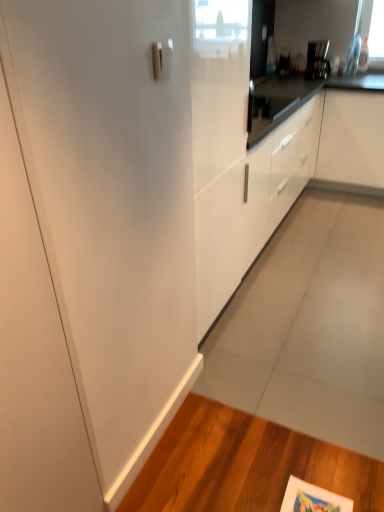
This screenshot has height=512, width=384. Identify the location of satin black coffee maker at upper right. (317, 60).

Based on the photo, is the surface of white glossy cabinet at center, acting as the second cabinetry starting from the right, in direct contact with white matte cabinet at center, placed as the 1th cabinetry when sorted from right to left?

No, white glossy cabinet at center, acting as the second cabinetry starting from the right, is not touching white matte cabinet at center, placed as the 1th cabinetry when sorted from right to left.

From a real-world perspective, between white glossy cabinet at center, acting as the second cabinetry starting from the right, and white matte cabinet at center, placed as the 1th cabinetry when sorted from right to left, who is vertically higher?

white glossy cabinet at center, acting as the second cabinetry starting from the right, from a real-world perspective.

In terms of width, does white glossy cabinet at center, which is the first cabinetry from left to right, look wider or thinner when compared to white matte cabinet at center, which is the second cabinetry in left-to-right order?

Clearly, white glossy cabinet at center, which is the first cabinetry from left to right, has more width compared to white matte cabinet at center, which is the second cabinetry in left-to-right order.

Considering the points (214, 217) and (340, 163), which point is in front, point (214, 217) or point (340, 163)?

Positioned in front is point (214, 217).

Which is more to the left, white glossy cabinet at center, acting as the second cabinetry starting from the right, or satin black coffee maker at upper right?

white glossy cabinet at center, acting as the second cabinetry starting from the right, is more to the left.

Relative to satin black coffee maker at upper right, is white glossy cabinet at center, which is the first cabinetry from left to right, in front or behind?

Clearly, white glossy cabinet at center, which is the first cabinetry from left to right, is in front of satin black coffee maker at upper right.

Can you see white glossy cabinet at center, which is the first cabinetry from left to right, touching satin black coffee maker at upper right?

No, white glossy cabinet at center, which is the first cabinetry from left to right, is not in contact with satin black coffee maker at upper right.

From the image's perspective, which one is positioned lower, white glossy cabinet at center, acting as the second cabinetry starting from the right, or satin black coffee maker at upper right?

From the image's view, white glossy cabinet at center, acting as the second cabinetry starting from the right, is below.

Can satin nickel door handle at upper center be found inside white matte cabinet at center, which is the second cabinetry in left-to-right order?

Definitely not — satin nickel door handle at upper center is not inside white matte cabinet at center, which is the second cabinetry in left-to-right order.

Which of these two, white matte cabinet at center, placed as the 1th cabinetry when sorted from right to left, or satin nickel door handle at upper center, stands taller?

Standing taller between the two is white matte cabinet at center, placed as the 1th cabinetry when sorted from right to left.

From a real-world perspective, is white matte cabinet at center, placed as the 1th cabinetry when sorted from right to left, physically located above or below satin nickel door handle at upper center?

Clearly, from a real-world perspective, white matte cabinet at center, placed as the 1th cabinetry when sorted from right to left, is below satin nickel door handle at upper center.

Can you see white matte cabinet at center, placed as the 1th cabinetry when sorted from right to left, touching satin nickel door handle at upper center?

No.

Does satin black coffee maker at upper right appear on the left side of satin nickel door handle at upper center?

No.

Where is `appliance behind the satin nickel door handle at upper center`? The height and width of the screenshot is (512, 384). appliance behind the satin nickel door handle at upper center is located at coordinates (317, 60).

Choose the correct answer: Is satin black coffee maker at upper right inside satin nickel door handle at upper center or outside it?

satin black coffee maker at upper right is not enclosed by satin nickel door handle at upper center.

From a real-world perspective, which object rests below the other?

satin black coffee maker at upper right is physically lower.

How much distance is there between satin nickel door handle at upper center and satin black coffee maker at upper right?

satin nickel door handle at upper center and satin black coffee maker at upper right are 3.02 meters apart from each other.

Is satin nickel door handle at upper center looking in the opposite direction of satin black coffee maker at upper right?

satin nickel door handle at upper center does not have its back to satin black coffee maker at upper right.

Can satin black coffee maker at upper right be found inside satin nickel door handle at upper center?

That's incorrect, satin black coffee maker at upper right is not inside satin nickel door handle at upper center.

Does satin nickel door handle at upper center have a lesser height compared to satin black coffee maker at upper right?

A: Yes, satin nickel door handle at upper center is shorter than satin black coffee maker at upper right.

From the image's perspective, relative to white glossy cabinet at center, which is the first cabinetry from left to right, is satin nickel door handle at upper center above or below?

satin nickel door handle at upper center is situated lower than white glossy cabinet at center, which is the first cabinetry from left to right, in the image.

Locate an element on the screen. The image size is (384, 512). door handle that is below the white glossy cabinet at center, which is the first cabinetry from left to right (from the image's perspective) is located at coordinates (162, 59).

Is satin nickel door handle at upper center not near white glossy cabinet at center, acting as the second cabinetry starting from the right?

Yes.

Would you say satin nickel door handle at upper center is outside white glossy cabinet at center, which is the first cabinetry from left to right?

That's correct, satin nickel door handle at upper center is outside of white glossy cabinet at center, which is the first cabinetry from left to right.

Is white matte cabinet at center, which is the second cabinetry in left-to-right order, taller or shorter than satin black coffee maker at upper right?

white matte cabinet at center, which is the second cabinetry in left-to-right order, is taller than satin black coffee maker at upper right.

Locate an element on the screen. The height and width of the screenshot is (512, 384). cabinetry on the right of satin black coffee maker at upper right is located at coordinates (352, 138).

How many degrees apart are the facing directions of white matte cabinet at center, placed as the 1th cabinetry when sorted from right to left, and satin black coffee maker at upper right?

There is a 28.4-degree angle between the facing directions of white matte cabinet at center, placed as the 1th cabinetry when sorted from right to left, and satin black coffee maker at upper right.

From a real-world perspective, is white matte cabinet at center, which is the second cabinetry in left-to-right order, physically below satin black coffee maker at upper right?

Yes, from a real-world perspective, white matte cabinet at center, which is the second cabinetry in left-to-right order, is beneath satin black coffee maker at upper right.

I want to click on cabinetry located underneath the white glossy cabinet at center, acting as the second cabinetry starting from the right (from a real-world perspective), so click(352, 138).

The height and width of the screenshot is (512, 384). What are the coordinates of `the 2nd cabinetry in front when counting from the satin black coffee maker at upper right` in the screenshot? It's located at (284, 188).

Consider the image. Based on their spatial positions, is white matte cabinet at center, which is the second cabinetry in left-to-right order, or white glossy cabinet at center, which is the first cabinetry from left to right, closer to satin nickel door handle at upper center?

white glossy cabinet at center, which is the first cabinetry from left to right, is positioned closer to the anchor satin nickel door handle at upper center.

Which object lies further to the anchor point white glossy cabinet at center, acting as the second cabinetry starting from the right, satin nickel door handle at upper center or white matte cabinet at center, placed as the 1th cabinetry when sorted from right to left?

satin nickel door handle at upper center.

Estimate the real-world distances between objects in this image. Which object is further from white glossy cabinet at center, which is the first cabinetry from left to right, white matte cabinet at center, which is the second cabinetry in left-to-right order, or satin nickel door handle at upper center?

Among the two, satin nickel door handle at upper center is located further to white glossy cabinet at center, which is the first cabinetry from left to right.

Which object lies further to the anchor point white matte cabinet at center, placed as the 1th cabinetry when sorted from right to left, satin black coffee maker at upper right or white glossy cabinet at center, which is the first cabinetry from left to right?

white glossy cabinet at center, which is the first cabinetry from left to right, is further to white matte cabinet at center, placed as the 1th cabinetry when sorted from right to left.

Looking at the image, which one is located closer to white glossy cabinet at center, acting as the second cabinetry starting from the right, white matte cabinet at center, which is the second cabinetry in left-to-right order, or satin black coffee maker at upper right?

Based on the image, white matte cabinet at center, which is the second cabinetry in left-to-right order, appears to be nearer to white glossy cabinet at center, acting as the second cabinetry starting from the right.

When comparing their distances from satin black coffee maker at upper right, does satin nickel door handle at upper center or white glossy cabinet at center, which is the first cabinetry from left to right, seem closer?

white glossy cabinet at center, which is the first cabinetry from left to right, lies closer to satin black coffee maker at upper right than the other object.

Looking at this image, estimate the real-world distances between objects in this image. Which object is closer to satin nickel door handle at upper center, white glossy cabinet at center, which is the first cabinetry from left to right, or satin black coffee maker at upper right?

white glossy cabinet at center, which is the first cabinetry from left to right, is closer to satin nickel door handle at upper center.

From the image, which object appears to be farther from white matte cabinet at center, placed as the 1th cabinetry when sorted from right to left, white glossy cabinet at center, which is the first cabinetry from left to right, or satin black coffee maker at upper right?

white glossy cabinet at center, which is the first cabinetry from left to right, is positioned further to the anchor white matte cabinet at center, placed as the 1th cabinetry when sorted from right to left.

At what (x,y) coordinates should I click in order to perform the action: click on cabinetry positioned between satin nickel door handle at upper center and white matte cabinet at center, which is the second cabinetry in left-to-right order, from near to far. Please return your answer as a coordinate pair (x, y). This screenshot has width=384, height=512. Looking at the image, I should click on (284, 188).

Find the location of a particular element. The image size is (384, 512). cabinetry between white glossy cabinet at center, which is the first cabinetry from left to right, and satin black coffee maker at upper right, along the z-axis is located at coordinates (352, 138).